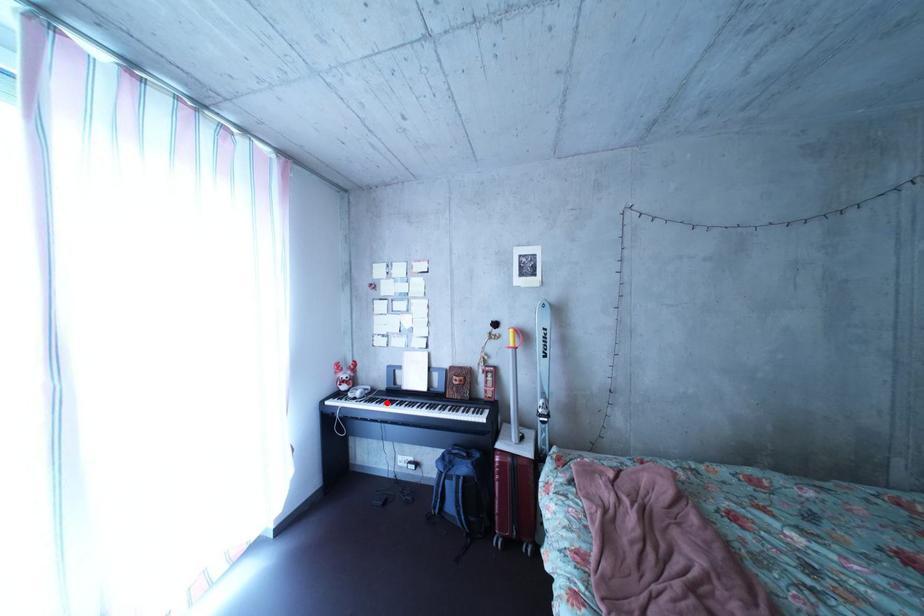
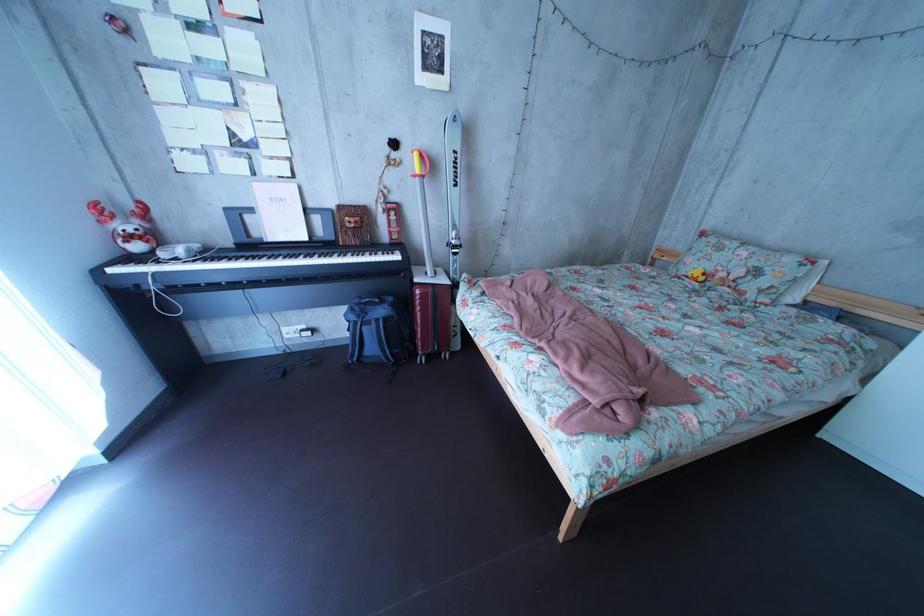
Question: I am providing you with two images of the same scene from different viewpoints. Given a red point in image1, look at the same physical point in image2. Is it:

Choices:
 (A) Closer to the viewpoint
 (B) Farther from the viewpoint

Answer: (A)